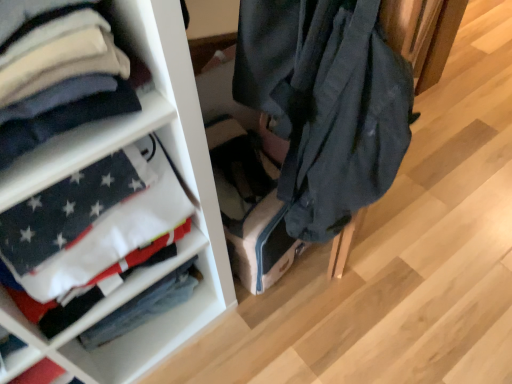
Question: From a real-world perspective, is white cotton shirt at left physically above white fabric at left?

Choices:
 (A) yes
 (B) no

Answer: (A)

Question: Considering the relative sizes of white cotton shirt at left and white fabric at left in the image provided, is white cotton shirt at left thinner than white fabric at left?

Choices:
 (A) no
 (B) yes

Answer: (A)

Question: Is white cotton shirt at left surrounding white fabric at left?

Choices:
 (A) no
 (B) yes

Answer: (A)

Question: Considering the relative positions of white cotton shirt at left and white fabric at left in the image provided, is white cotton shirt at left to the right of white fabric at left from the viewer's perspective?

Choices:
 (A) no
 (B) yes

Answer: (A)

Question: From the image's perspective, does white cotton shirt at left appear lower than white fabric at left?

Choices:
 (A) no
 (B) yes

Answer: (A)

Question: From the image's perspective, is white cotton shirt at left on top of white fabric at left?

Choices:
 (A) yes
 (B) no

Answer: (A)

Question: From the image's perspective, would you say white cotton shirt at left is shown under white cotton flag at left?

Choices:
 (A) yes
 (B) no

Answer: (B)

Question: Is white cotton flag at left inside white cotton shirt at left?

Choices:
 (A) yes
 (B) no

Answer: (B)

Question: Does white cotton shirt at left have a larger size compared to white cotton flag at left?

Choices:
 (A) no
 (B) yes

Answer: (B)

Question: Can you confirm if white cotton shirt at left is taller than white cotton flag at left?

Choices:
 (A) yes
 (B) no

Answer: (A)

Question: Does white cotton shirt at left appear on the left side of white cotton flag at left?

Choices:
 (A) yes
 (B) no

Answer: (A)

Question: Can you confirm if white cotton shirt at left is thinner than white cotton flag at left?

Choices:
 (A) no
 (B) yes

Answer: (A)

Question: Can you confirm if white fabric at left is bigger than white cotton shirt at left?

Choices:
 (A) yes
 (B) no

Answer: (A)